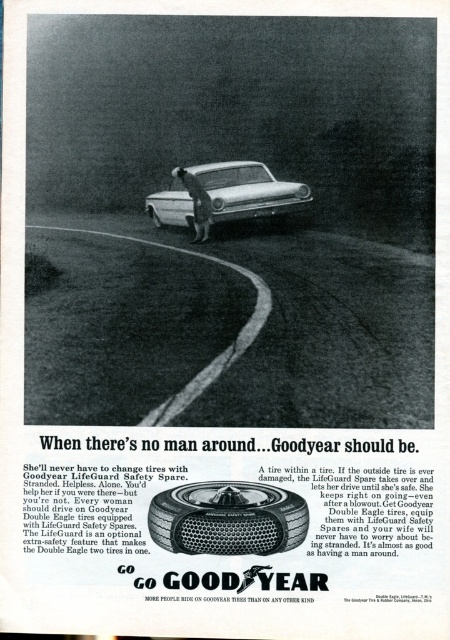
Based on the scene described in the vintage Goodyear advertisement, where is the dirt track at center positioned in relation to the car and the trees?

The dirt track at center is located at point coordinates approximately 0.516 on the x axis and 0.502 on the y axis, but since the exact spatial relationships between the car, trees, and track aren

You are a driver stranded at night on a curving road surrounded by trees. You need to check if your spare tire can fit into your car trunk. Given that the silver metallic sedan at center is wider than the matte rubber tire at center, can you confirm if the spare tire will fit?

The silver metallic sedan at center is wider than the matte rubber tire at center, so the spare tire should fit into the car trunk since the car is wider than the tire.

You are a driver stranded at night on a curving road with a flat tire. You have two points marked on your spare tire container. Which point, point (217, 541) or point (221, 218), is closer to you when you are inspecting the spare tire container?

Point (217, 541) is closer to the viewer than point (221, 218).